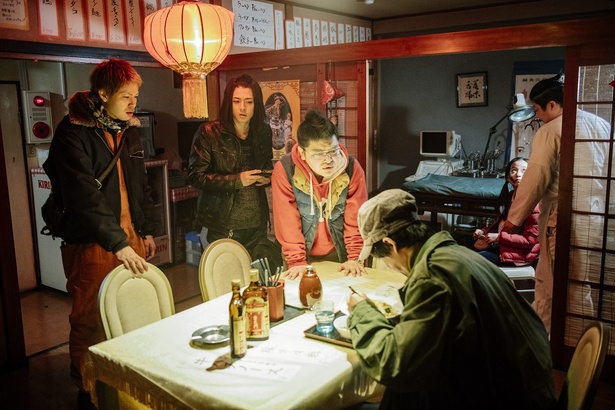
Image resolution: width=615 pixels, height=410 pixels. Find the location of `door frame`. door frame is located at coordinates (435, 50), (565, 235), (355, 131).